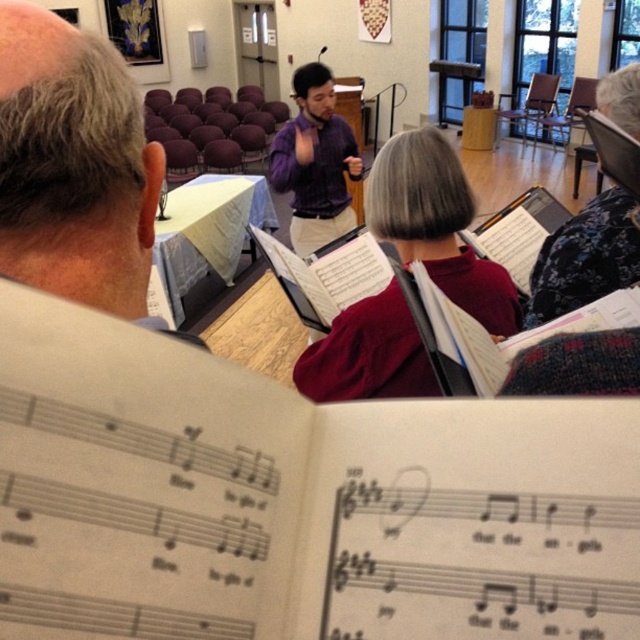
Does maroon sweater at center have a larger size compared to purple matte shirt at center?

No.

Who is positioned more to the left, maroon sweater at center or purple matte shirt at center?

purple matte shirt at center is more to the left.

Between point (522, 323) and point (342, 224), which one is positioned in front?

Point (522, 323)

Where is `maroon sweater at center`? The image size is (640, 640). maroon sweater at center is located at coordinates (436, 225).

Is point (131, 115) positioned after point (317, 74)?

No, (131, 115) is closer to viewer.

Can you confirm if gray hair at upper left is thinner than purple matte shirt at center?

Indeed, gray hair at upper left has a lesser width compared to purple matte shirt at center.

What do you see at coordinates (74, 168) in the screenshot? I see `gray hair at upper left` at bounding box center [74, 168].

Where is `gray hair at upper left`? This screenshot has height=640, width=640. gray hair at upper left is located at coordinates (74, 168).

Can you confirm if gray hair at upper left is bigger than maroon sweater at center?

No, gray hair at upper left is not bigger than maroon sweater at center.

Between point (72, 68) and point (416, 204), which one is positioned in front?

Point (72, 68)

What are the coordinates of `gray hair at upper left` in the screenshot? It's located at (74, 168).